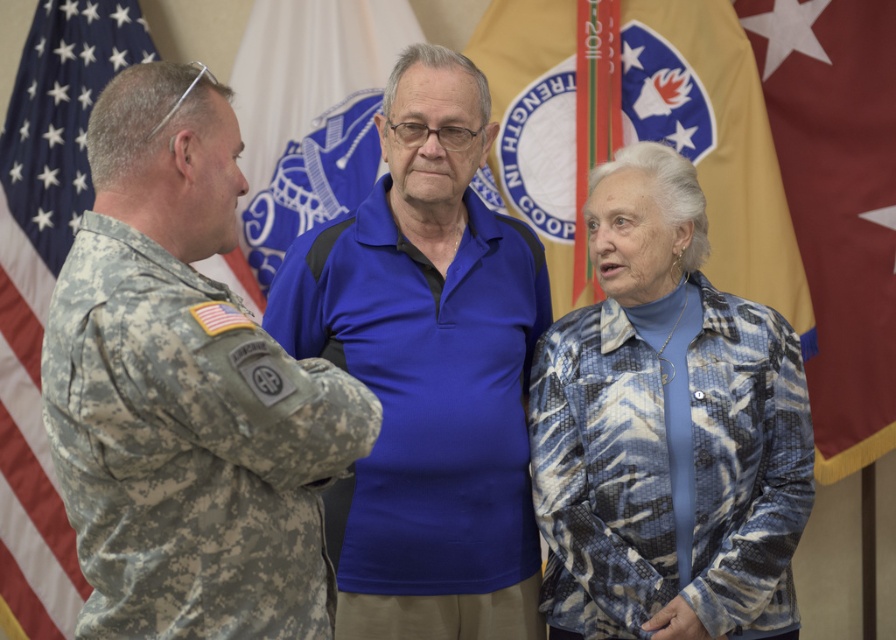
You are at the center of the image and need to locate the camouflage uniform at left. Which direction should you look to find it?

You should look to your left to find the camouflage uniform at left since it is positioned at the left side of the image.

You are standing in the room and want to hand a document to the person wearing the blue textured jacket at center. To do so, should you move towards the left or right side of the yellow fabric flag at upper center?

You should move towards the left side of the yellow fabric flag at upper center because the blue textured jacket at center is positioned to the left of the yellow fabric flag at upper center.

Looking at this image, you are a photographer at the event and need to capture a photo where both the blue jersey at center and the blue fabric flag at center are visible. Which object should you focus on first to ensure both are in frame?

The blue jersey at center is taller than the blue fabric flag at center, so focusing on the blue jersey at center first will help ensure both are in frame.